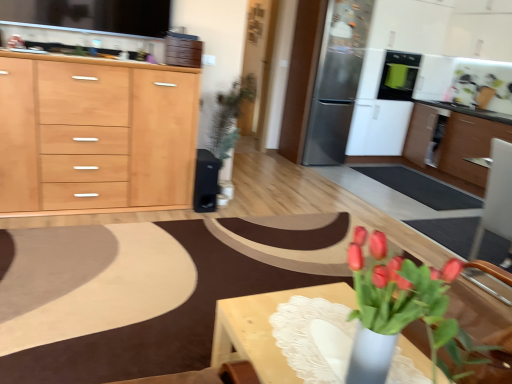
In order to face wooden cabinet at right, positioned as the first cabinetry in back-to-front order, should I rotate leftwards or rightwards?

Turn right by 26.680 degrees to look at wooden cabinet at right, positioned as the first cabinetry in back-to-front order.

What is the approximate height of wooden table at lower right?

17.60 inches.

Locate an element on the screen. light wood/texture cabinet at left, the second cabinetry when ordered from right to left is located at coordinates (95, 136).

The image size is (512, 384). What do you see at coordinates (95, 136) in the screenshot?
I see `light wood/texture cabinet at left, which is counted as the 1th cabinetry, starting from the left` at bounding box center [95, 136].

Identify the location of stainless steel refrigerator at upper right. The width and height of the screenshot is (512, 384). (435, 33).

The image size is (512, 384). What do you see at coordinates (97, 61) in the screenshot?
I see `wooden countertop at upper center` at bounding box center [97, 61].

How much space does satin silver refrigerator at upper right, which is the second appliance from front to back, occupy vertically?

It is 6.42 feet.

The height and width of the screenshot is (384, 512). I want to click on wooden cabinet at right, the 1th cabinetry from the right, so click(x=469, y=145).

Does black glossy oven at upper right, which is the 3th appliance from left to right, lie behind wooden cabinet at right, which ranks as the second cabinetry in front-to-back order?

Yes, it is behind wooden cabinet at right, which ranks as the second cabinetry in front-to-back order.

Between point (390, 73) and point (414, 106), which one is positioned behind?

The point (414, 106) is behind.

In the image, is black glossy oven at upper right, which is the 3th appliance from left to right, on the left side or the right side of wooden cabinet at right, placed as the 2th cabinetry when sorted from left to right?

From the image, it's evident that black glossy oven at upper right, which is the 3th appliance from left to right, is to the left of wooden cabinet at right, placed as the 2th cabinetry when sorted from left to right.

Which is correct: wooden cabinet at right, the 1th cabinetry from the right, is inside black glossy oven at upper right, placed as the first appliance when sorted from back to front, or outside of it?

wooden cabinet at right, the 1th cabinetry from the right, cannot be found inside black glossy oven at upper right, placed as the first appliance when sorted from back to front.

How many degrees apart are the facing directions of wooden cabinet at right, the 1th cabinetry from the right, and black glossy oven at upper right, placed as the first appliance when sorted from back to front?

90 degrees.

From a real-world perspective, is wooden cabinet at right, placed as the 2th cabinetry when sorted from left to right, below black glossy oven at upper right, placed as the first appliance when sorted from back to front?

Yes, from a real-world perspective, wooden cabinet at right, placed as the 2th cabinetry when sorted from left to right, is beneath black glossy oven at upper right, placed as the first appliance when sorted from back to front.

Which cabinetry is the 1st one when counting from the front of the black glossy oven at upper right, acting as the third appliance starting from the front? Please provide its 2D coordinates.

[(469, 145)]

Which is more to the left, black matte speaker at center, the 1th appliance in the front-to-back sequence, or wooden table at lower right?

From the viewer's perspective, black matte speaker at center, the 1th appliance in the front-to-back sequence, appears more on the left side.

Is black matte speaker at center, the 1th appliance when ordered from left to right, far from wooden table at lower right?

Yes.

From the image's perspective, is black matte speaker at center, the 1th appliance in the front-to-back sequence, over wooden table at lower right?

Yes, from the image's perspective, black matte speaker at center, the 1th appliance in the front-to-back sequence, is above wooden table at lower right.

Could you tell me if stainless steel refrigerator at upper right is turned towards wooden countertop at upper center?

No, stainless steel refrigerator at upper right is not oriented towards wooden countertop at upper center.

Looking at their sizes, would you say stainless steel refrigerator at upper right is wider or thinner than wooden countertop at upper center?

stainless steel refrigerator at upper right is wider than wooden countertop at upper center.

Would you say stainless steel refrigerator at upper right is to the left or to the right of wooden countertop at upper center in the picture?

stainless steel refrigerator at upper right is positioned on wooden countertop at upper center's right side.

Does point (441, 39) lie in front of point (9, 52)?

No, (441, 39) is behind (9, 52).

What's the angular difference between wooden cabinet at right, which ranks as the second cabinetry in front-to-back order, and black matte speaker at center, the 1th appliance when ordered from left to right,'s facing directions?

There is a 88.8-degree angle between the facing directions of wooden cabinet at right, which ranks as the second cabinetry in front-to-back order, and black matte speaker at center, the 1th appliance when ordered from left to right.

Considering the relative sizes of wooden cabinet at right, placed as the 2th cabinetry when sorted from left to right, and black matte speaker at center, the 1th appliance when ordered from left to right, in the image provided, is wooden cabinet at right, placed as the 2th cabinetry when sorted from left to right, wider than black matte speaker at center, the 1th appliance when ordered from left to right,?

Yes, wooden cabinet at right, placed as the 2th cabinetry when sorted from left to right, is wider than black matte speaker at center, the 1th appliance when ordered from left to right.

Does wooden cabinet at right, which ranks as the second cabinetry in front-to-back order, lie behind black matte speaker at center, the 1th appliance when ordered from left to right?

Yes, wooden cabinet at right, which ranks as the second cabinetry in front-to-back order, is further from the camera.

Which is less distant, (470, 129) or (213, 206)?

Point (470, 129).

Is matte pink tulips at lower right thinner than stainless steel refrigerator at upper right?

Yes.

Is matte pink tulips at lower right facing towards stainless steel refrigerator at upper right?

No, matte pink tulips at lower right is not turned towards stainless steel refrigerator at upper right.

Who is bigger, matte pink tulips at lower right or stainless steel refrigerator at upper right?

Bigger between the two is stainless steel refrigerator at upper right.

Which object is positioned more to the right, matte pink tulips at lower right or stainless steel refrigerator at upper right?

stainless steel refrigerator at upper right.

At what (x,y) coordinates should I click in order to perform the action: click on entertainment center above the satin silver refrigerator at upper right, which is the second appliance from front to back (from a real-world perspective). Please return your answer as a coordinate pair (x, y). This screenshot has width=512, height=384. Looking at the image, I should click on (435, 33).

Which point is more distant from viewer, (428, 50) or (351, 111)?

The point (428, 50) is behind.

Can we say stainless steel refrigerator at upper right lies outside satin silver refrigerator at upper right, placed as the 2th appliance when sorted from back to front?

That's correct, stainless steel refrigerator at upper right is outside of satin silver refrigerator at upper right, placed as the 2th appliance when sorted from back to front.

Who is more distant, stainless steel refrigerator at upper right or satin silver refrigerator at upper right, which ranks as the second appliance in right-to-left order?

satin silver refrigerator at upper right, which ranks as the second appliance in right-to-left order.

Where is `the 2nd appliance above the wooden cabinet at right, placed as the 2th cabinetry when sorted from left to right (from a real-world perspective)`? the 2nd appliance above the wooden cabinet at right, placed as the 2th cabinetry when sorted from left to right (from a real-world perspective) is located at coordinates (399, 75).

Which appliance is the 1st one when counting from the left side of the wooden cabinet at right, placed as the 2th cabinetry when sorted from left to right? Please provide its 2D coordinates.

[(399, 75)]

Which object lies further to the anchor point satin silver refrigerator at upper right, arranged as the second appliance when viewed from the left, light wood/texture cabinet at left, the 2th cabinetry in the back-to-front sequence, or wooden cabinet at right, placed as the 2th cabinetry when sorted from left to right?

light wood/texture cabinet at left, the 2th cabinetry in the back-to-front sequence, is positioned further to the anchor satin silver refrigerator at upper right, arranged as the second appliance when viewed from the left.

From the image, which object appears to be nearer to matte pink tulips at lower right, satin silver refrigerator at upper right, which is the second appliance from front to back, or black glossy oven at upper right, placed as the first appliance when sorted from back to front?

satin silver refrigerator at upper right, which is the second appliance from front to back.

From the image, which object appears to be nearer to wooden cabinet at right, the 1th cabinetry from the right, stainless steel refrigerator at upper right or black matte speaker at center, the third appliance positioned from the right?

stainless steel refrigerator at upper right is positioned closer to the anchor wooden cabinet at right, the 1th cabinetry from the right.

Considering their positions, is wooden countertop at upper center positioned closer to stainless steel refrigerator at upper right than black glossy oven at upper right, which is the 3th appliance from left to right?

black glossy oven at upper right, which is the 3th appliance from left to right.

Looking at the image, which one is located closer to matte pink tulips at lower right, stainless steel refrigerator at upper right or wooden countertop at upper center?

The object closer to matte pink tulips at lower right is wooden countertop at upper center.

Estimate the real-world distances between objects in this image. Which object is further from matte pink tulips at lower right, black glossy oven at upper right, which is the 3th appliance from left to right, or light wood/texture cabinet at left, the second cabinetry when ordered from right to left?

Based on the image, black glossy oven at upper right, which is the 3th appliance from left to right, appears to be further to matte pink tulips at lower right.

Considering their positions, is black matte speaker at center, the third appliance positioned from the right, positioned further to wooden cabinet at right, positioned as the first cabinetry in back-to-front order, than wooden table at lower right?

wooden table at lower right lies further to wooden cabinet at right, positioned as the first cabinetry in back-to-front order, than the other object.

Looking at the image, which one is located closer to black matte speaker at center, the 1th appliance when ordered from left to right, stainless steel refrigerator at upper right or black glossy oven at upper right, which is the 3th appliance from left to right?

black glossy oven at upper right, which is the 3th appliance from left to right, lies closer to black matte speaker at center, the 1th appliance when ordered from left to right, than the other object.

The width and height of the screenshot is (512, 384). In order to click on entertainment center between black matte speaker at center, the third appliance positioned from the right, and black glossy oven at upper right, which appears as the 1th appliance when viewed from the right, from left to right in this screenshot , I will do `click(435, 33)`.

The width and height of the screenshot is (512, 384). Identify the location of countertop between matte pink tulips at lower right and black glossy oven at upper right, acting as the third appliance starting from the front, from front to back. (97, 61).

The width and height of the screenshot is (512, 384). In order to click on entertainment center between light wood/texture cabinet at left, the 2th cabinetry in the back-to-front sequence, and black glossy oven at upper right, acting as the third appliance starting from the front, in the horizontal direction in this screenshot , I will do `click(435, 33)`.

I want to click on table between matte pink tulips at lower right and black glossy oven at upper right, placed as the first appliance when sorted from back to front, along the z-axis, so click(x=264, y=329).